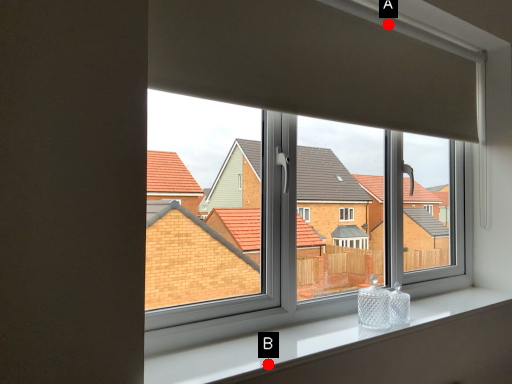
Question: Two points are circled on the image, labeled by A and B beside each circle. Which point is closer to the camera?

Choices:
 (A) A is closer
 (B) B is closer

Answer: (B)